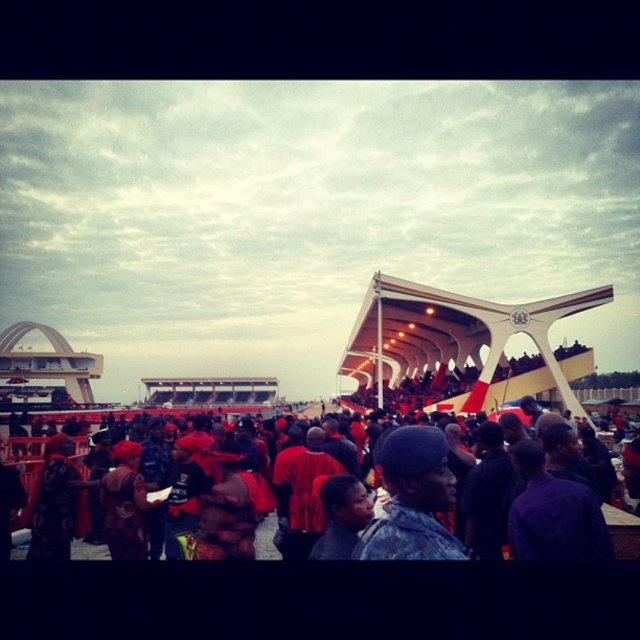
You are a photographer trying to capture a wide shot of the crowd at this event. You notice the camouflage uniform at center and the red fabric clothing at lower center. Which of these two items of clothing will appear smaller in the photo due to their actual size?

The camouflage uniform at center will appear smaller in the photo because its width is less than that of the red fabric clothing at lower center.

You are a photographer standing at the event and want to capture a closeup shot of the camouflage uniform at center. Given that your camera can focus on subjects within 100 meters, will you be able to capture a clear closeup?

The camouflage uniform at center is 102.79 meters from the camera, which is slightly beyond the camera focus range of 100 meters. Therefore, you cannot capture a clear closeup.

You are a photographer positioned at the camouflage uniform at center and want to capture a closeup shot of the red fabric clothing at lower center. Given that your camera has a maximum zoom range of 30 meters, will you be able to get a clear closeup without moving closer?

The distance between the camouflage uniform at center and red fabric clothing at lower center is 36.58 meters. Since your camera can only zoom up to 30 meters, you won